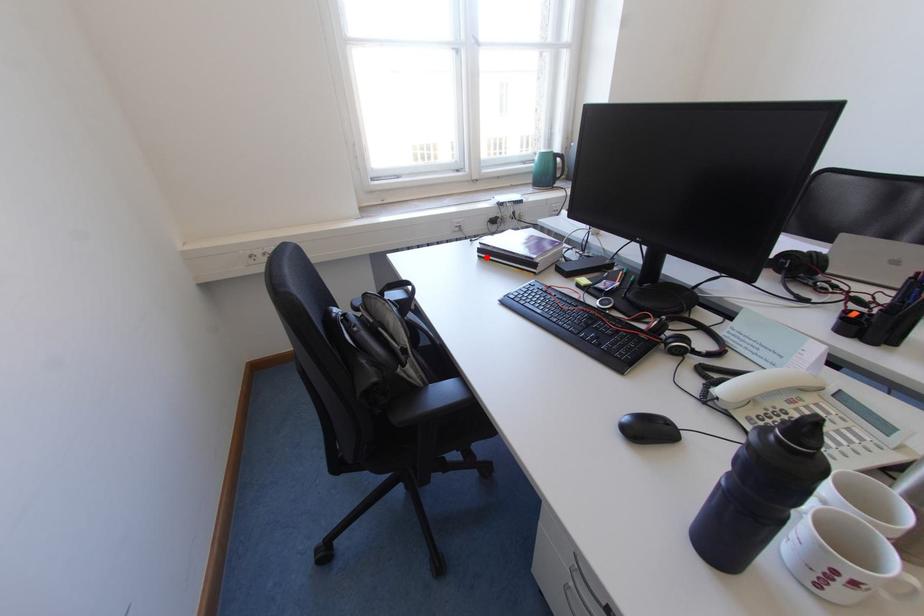
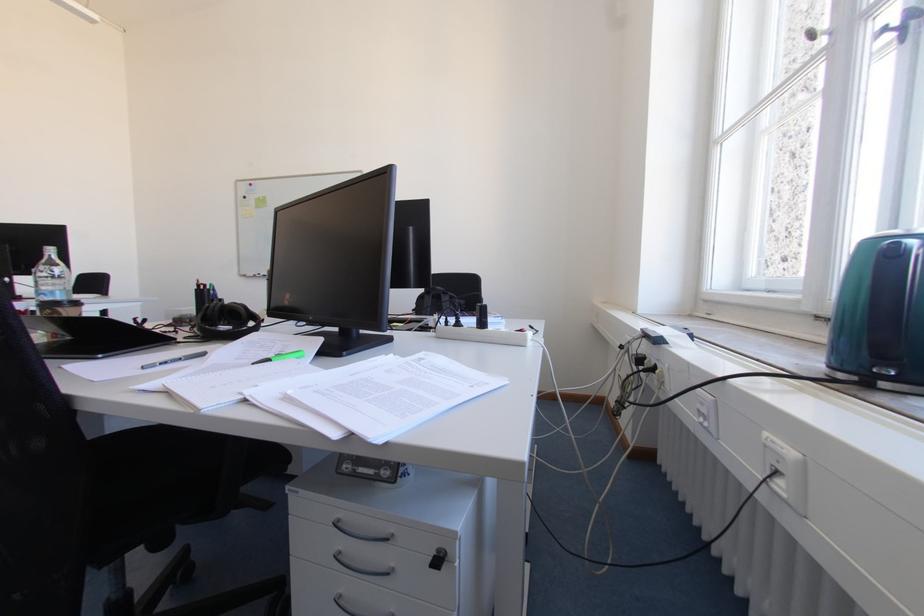
Question: I am providing you with two images of the same scene from different viewpoints. A red point is marked on the first image. Can you still see the location of the red point in image 2?

Choices:
 (A) Yes
 (B) No

Answer: (B)